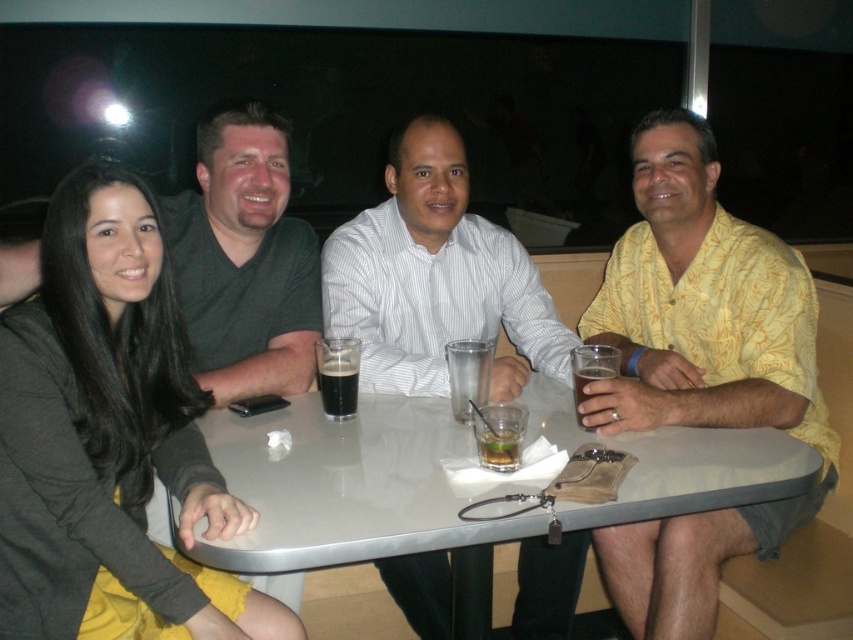
Question: Which point appears farthest from the camera in this image?

Choices:
 (A) (401, 515)
 (B) (595, 362)
 (C) (554, 310)

Answer: (C)

Question: Is matte black jacket at left below dark brown glass at table center?

Choices:
 (A) no
 (B) yes

Answer: (B)

Question: Does white striped shirt at center appear on the right side of dark brown liquid at table center?

Choices:
 (A) yes
 (B) no

Answer: (A)

Question: Which object is farther from the camera taking this photo?

Choices:
 (A) white glossy table at center
 (B) dark brown liquid at table center

Answer: (B)

Question: Does matte black jacket at left come behind yellow printed shirt at right?

Choices:
 (A) yes
 (B) no

Answer: (B)

Question: Which point appears farthest from the camera in this image?

Choices:
 (A) (334, 292)
 (B) (368, 518)
 (C) (654, 227)

Answer: (A)